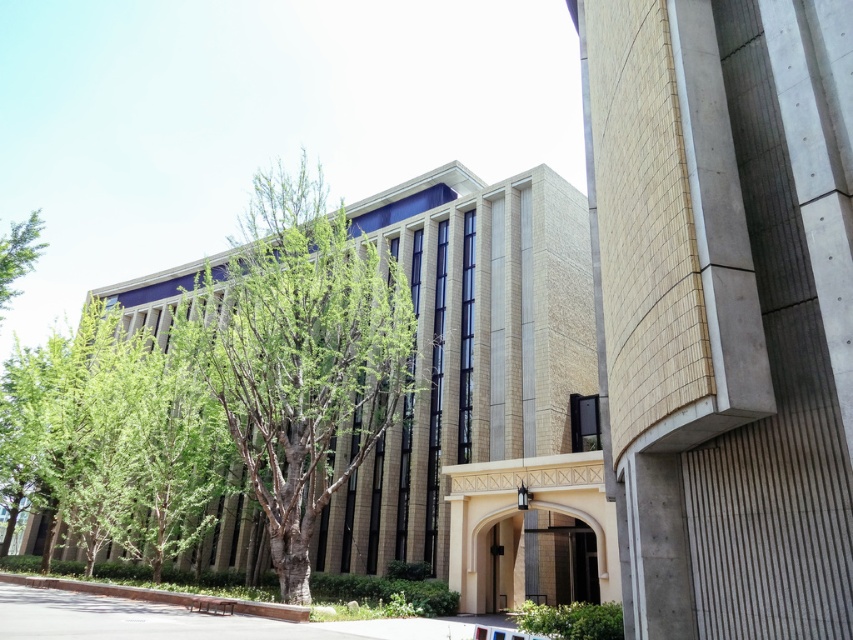
You are standing at the entrance of the modern architectural building and want to walk straight ahead towards the green leafy tree at center. According to the coordinates provided, will you need to adjust your direction to the left or right to reach it?

The green leafy tree at center is located at coordinates point (x=300, y=355), so you should walk straight ahead without needing to adjust your direction to the left or right.

You are standing at the entrance of the building and want to walk to the smooth concrete pavement at lower center. Is the path blocked by the green leafy tree at left?

The smooth concrete pavement at lower center is positioned under the green leafy tree at left, so the path is not blocked by the tree since the pavement is located beneath it.